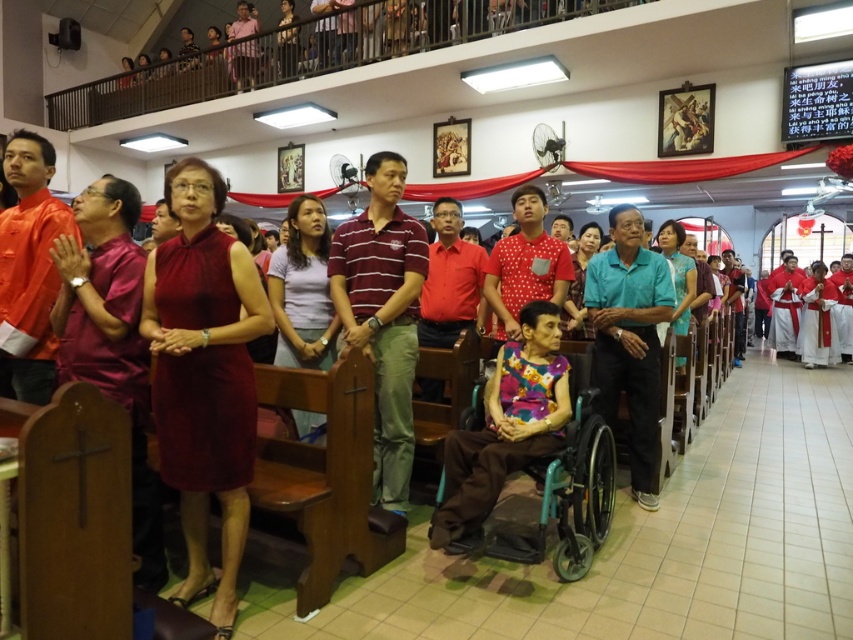
Question: Observing the image, what is the correct spatial positioning of maroon satin dress at center in reference to teal plastic wheelchair at center?

Choices:
 (A) right
 (B) left

Answer: (B)

Question: Can you confirm if maroon striped polo shirt at center is positioned below teal plastic wheelchair at center?

Choices:
 (A) yes
 (B) no

Answer: (B)

Question: Which point is closer to the camera?

Choices:
 (A) teal plastic wheelchair at center
 (B) maroon striped polo shirt at center
 (C) maroon satin dress at center
 (D) teal fabric shirt at center

Answer: (C)

Question: Which object appears closest to the camera in this image?

Choices:
 (A) maroon striped polo shirt at center
 (B) maroon satin dress at center

Answer: (B)

Question: Is maroon satin dress at center closer to camera compared to teal plastic wheelchair at center?

Choices:
 (A) yes
 (B) no

Answer: (A)

Question: Which point is closer to the camera taking this photo?

Choices:
 (A) (375, 397)
 (B) (202, 164)
 (C) (460, 538)

Answer: (B)